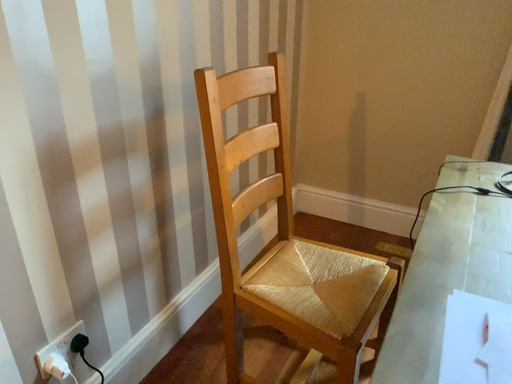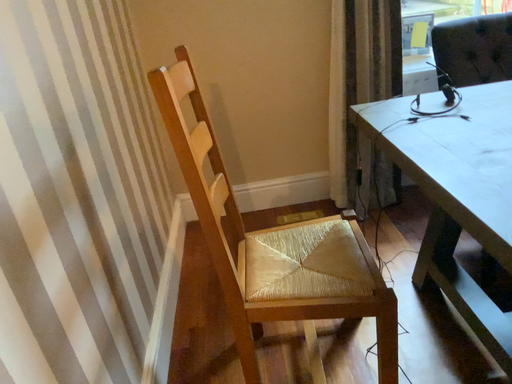
Question: How did the camera likely rotate when shooting the video?

Choices:
 (A) rotated downward
 (B) rotated upward

Answer: (B)